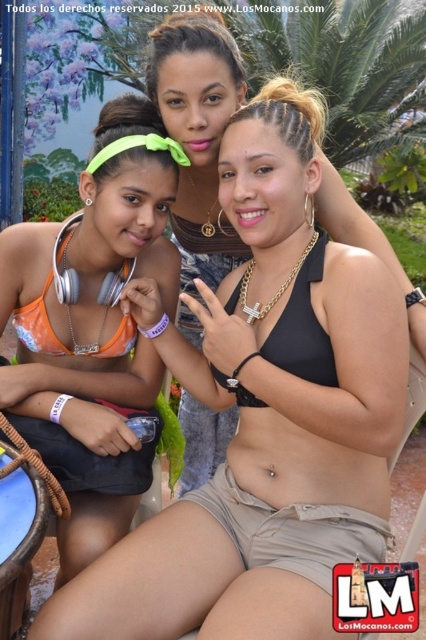
You are a photographer trying to capture a closeup of the orange fabric bikini top at left and the black matte bikini top at center. Which one will appear larger in your photo?

The orange fabric bikini top at left will appear larger in the photo because it is closer to the viewer than the black matte bikini top at center.

You are a photographer at this event and need to ensure all participants are visible in the group photo. Given the orange fabric bikini top at left and the black matte bikini top at center, which one has a wider horizontal span to account for in framing?

The orange fabric bikini top at left has a wider horizontal span than the black matte bikini top at center, so it requires more space in the framing.